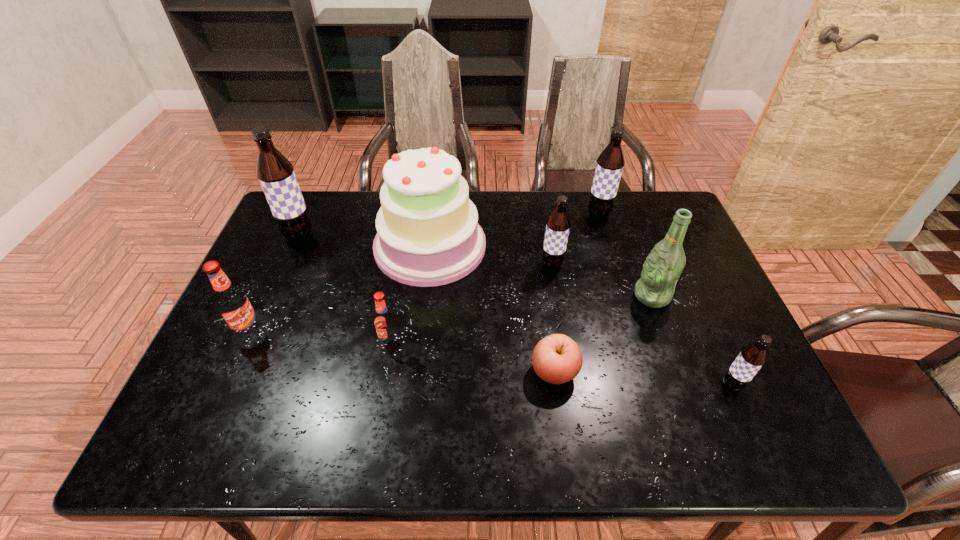
You are a GUI agent. You are given a task and a screenshot of the screen. Output one action in this format:
    pyautogui.click(x=<x>, y=<y>)
    Task: Click on the vacant space that satisfies the following two spatial constraints: 1. on the surface of the green beer bottle; 2. on the front side of the shortest object
    The width and height of the screenshot is (960, 540).
    Given the screenshot: What is the action you would take?
    pyautogui.click(x=679, y=372)

This screenshot has width=960, height=540. I want to click on free point that satisfies the following two spatial constraints: 1. on the front side of the tallest root beer; 2. on the right side of the purple cake, so click(x=295, y=246).